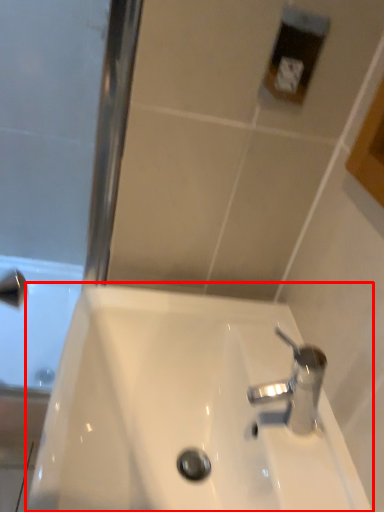
Question: Observing the image, what is the correct spatial positioning of sink (annotated by the red box) in reference to tap?

Choices:
 (A) left
 (B) right

Answer: (A)